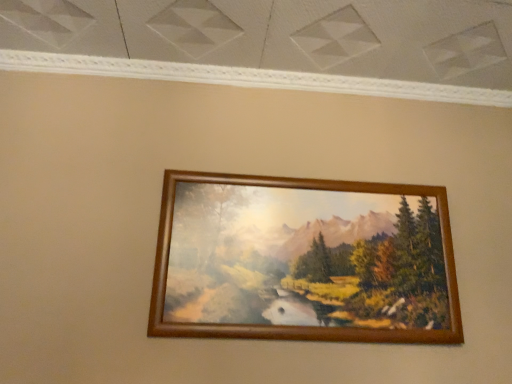
What is the approximate width of wooden picture frame at center?

It is 2.25 inches.

The image size is (512, 384). Describe the element at coordinates (304, 261) in the screenshot. I see `wooden picture frame at center` at that location.

This screenshot has height=384, width=512. I want to click on wooden picture frame at center, so click(304, 261).

In order to click on wooden picture frame at center in this screenshot , I will do click(x=304, y=261).